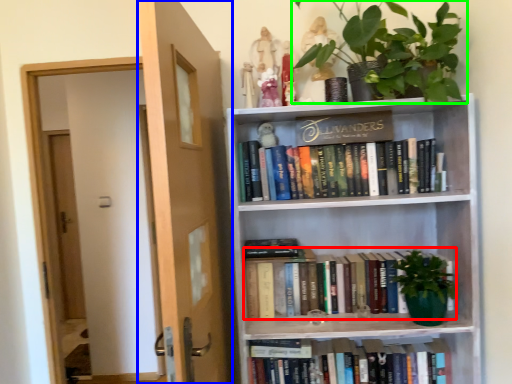
Question: Based on their relative distances, which object is farther from book (highlighted by a red box)? Choose from door (highlighted by a blue box) and houseplant (highlighted by a green box).

Choices:
 (A) door
 (B) houseplant

Answer: (B)